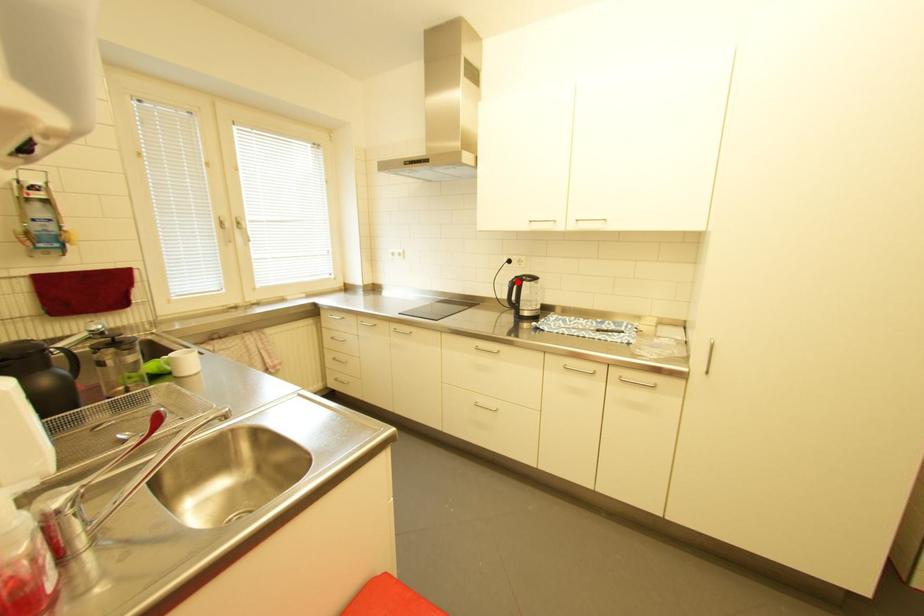
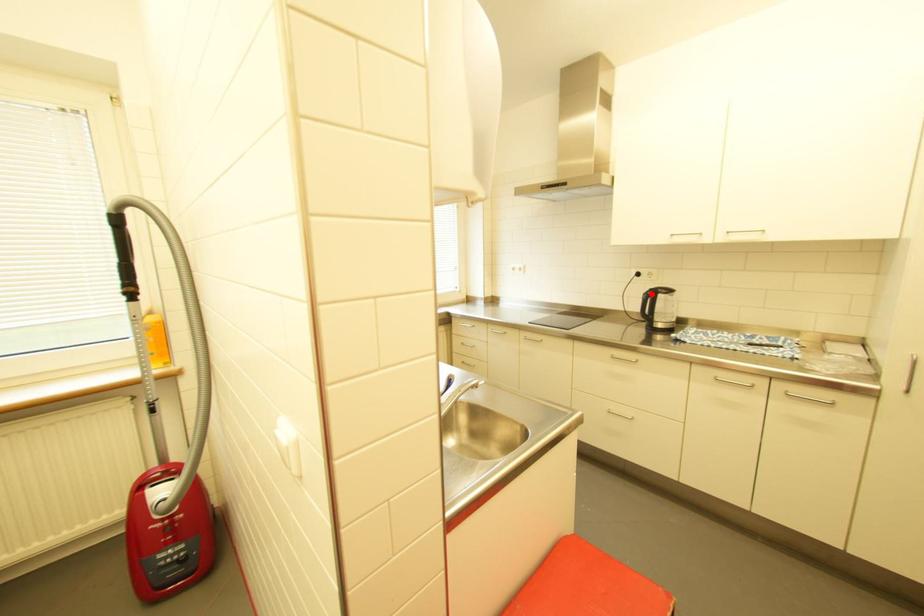
I am providing you with two images of the same scene from different viewpoints. A red point is marked on the first image and another point is marked on the second image. Is the marked point in image1 the same physical position as the marked point in image2?

Yes